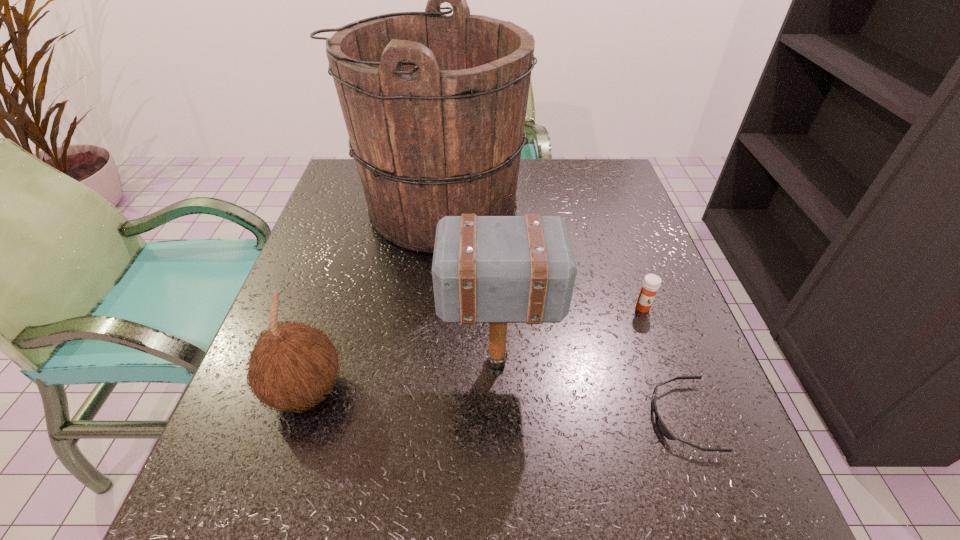
Where is `vacant space that satisfies the following two spatial constraints: 1. on the front side of the tallest object; 2. on the surface of the coconut`? vacant space that satisfies the following two spatial constraints: 1. on the front side of the tallest object; 2. on the surface of the coconut is located at coordinates (414, 390).